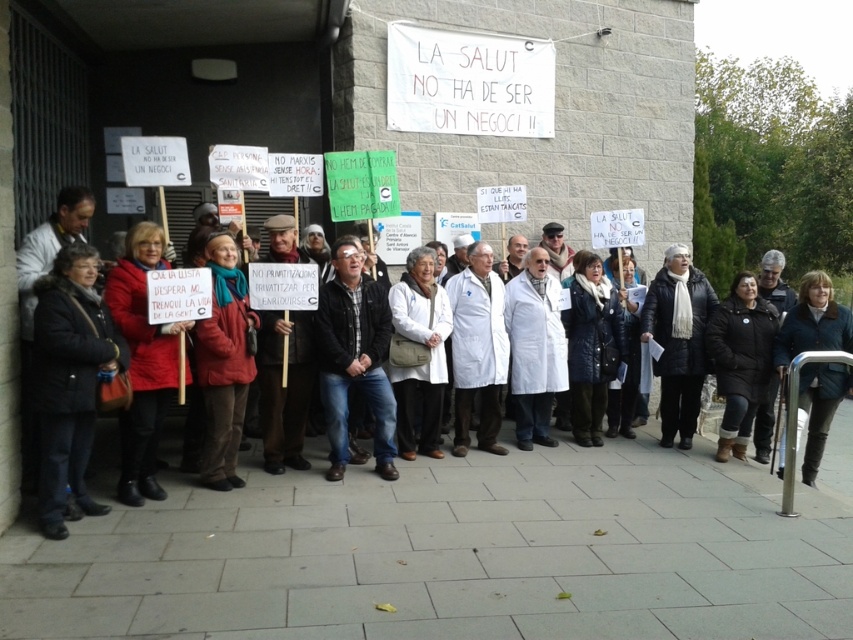
You are a photographer trying to capture a clear photo of both the black leather jacket at center and the blue woolen jacket at center. Since you want both jackets to be fully visible in the frame, which jacket should you focus on to ensure the other doesn t get cut off?

The black leather jacket at center is much taller than the blue woolen jacket at center. To ensure both are fully visible, focus on framing the taller black leather jacket at center so that the shorter blue woolen jacket at center fits within the same frame.

You are a photographer trying to capture a clear shot of both the white lab coat at center and the dark blue jeans at center. Since the camera can only focus on one subject at a time, which object should you focus on first to ensure the other remains in the frame?

The white lab coat at center is positioned under dark blue jeans at center. Therefore, focus on the dark blue jeans at center first, as it is above the white lab coat at center and will keep the lower one in the frame.

You are a photographer trying to capture a photo of the protest. You have a camera with a 1.2 meter wide lens. You need to frame both the black leather jacket at lower right and the blue woolen jacket at center in the same shot. Can you fit both jackets within the lens width?

The black leather jacket at lower right is wider than the blue woolen jacket at center. However, the total width required to include both would depend on their positions. Since the exact distance between them isn